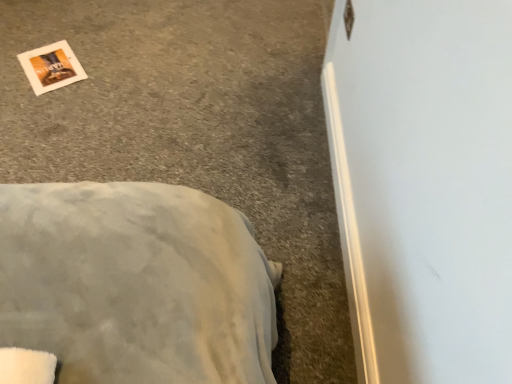
Identify the location of free space above white paper at upper left (from a real-world perspective). The width and height of the screenshot is (512, 384). (45, 61).